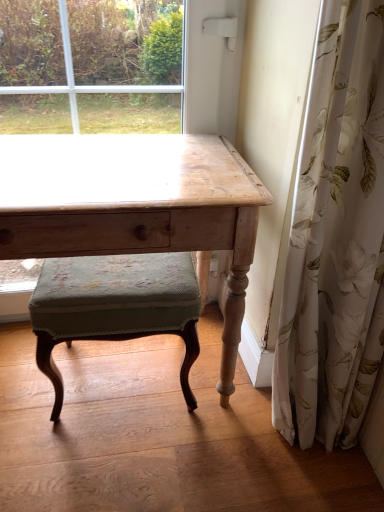
Question: Is the depth of wooden table at center less than that of white floral fabric at right?

Choices:
 (A) yes
 (B) no

Answer: (B)

Question: Is wooden table at center positioned far away from white floral fabric at right?

Choices:
 (A) yes
 (B) no

Answer: (B)

Question: From a real-world perspective, is wooden table at center beneath white floral fabric at right?

Choices:
 (A) no
 (B) yes

Answer: (B)

Question: Is wooden table at center touching white floral fabric at right?

Choices:
 (A) yes
 (B) no

Answer: (B)

Question: Is wooden table at center located outside white floral fabric at right?

Choices:
 (A) yes
 (B) no

Answer: (A)

Question: Is white floral fabric at right wider or thinner than wooden desk at center?

Choices:
 (A) thin
 (B) wide

Answer: (B)

Question: Which is correct: white floral fabric at right is inside wooden desk at center, or outside of it?

Choices:
 (A) outside
 (B) inside

Answer: (A)

Question: Considering the positions of point (332, 444) and point (162, 81), is point (332, 444) closer or farther from the camera than point (162, 81)?

Choices:
 (A) closer
 (B) farther

Answer: (A)

Question: Considering their positions, is white floral fabric at right located in front of or behind wooden desk at center?

Choices:
 (A) behind
 (B) front

Answer: (B)

Question: Is wooden table at center bigger or smaller than velvet green cushioned stool at center?

Choices:
 (A) big
 (B) small

Answer: (A)

Question: From a real-world perspective, is wooden table at center positioned above or below velvet green cushioned stool at center?

Choices:
 (A) above
 (B) below

Answer: (A)

Question: In terms of height, does wooden table at center look taller or shorter compared to velvet green cushioned stool at center?

Choices:
 (A) short
 (B) tall

Answer: (B)

Question: Do you think wooden table at center is within velvet green cushioned stool at center, or outside of it?

Choices:
 (A) outside
 (B) inside

Answer: (A)

Question: Relative to white floral fabric at right, is velvet green cushioned stool at center in front or behind?

Choices:
 (A) front
 (B) behind

Answer: (B)

Question: From a real-world perspective, is velvet green cushioned stool at center above or below white floral fabric at right?

Choices:
 (A) below
 (B) above

Answer: (A)